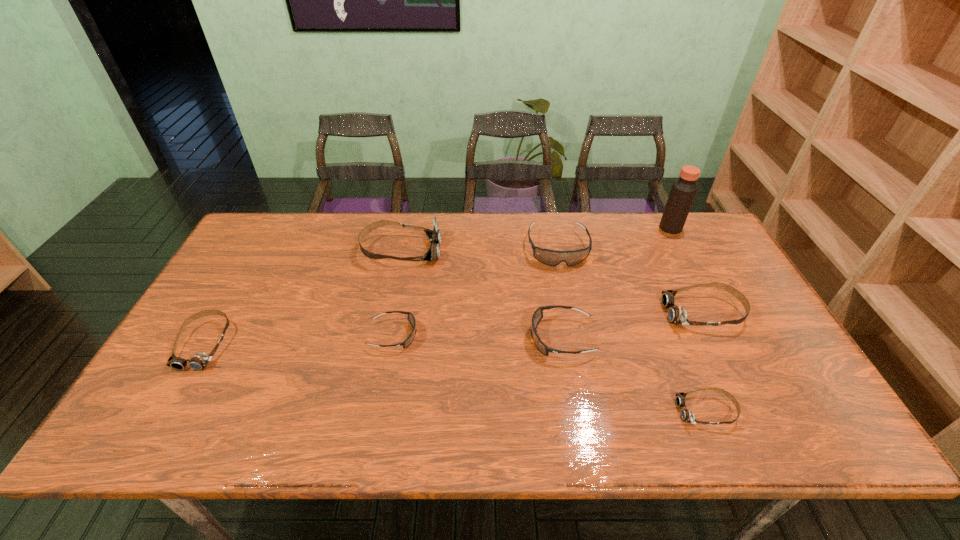
Where is `the tallest object`? the tallest object is located at coordinates (683, 191).

The image size is (960, 540). What are the coordinates of `vinegar` in the screenshot? It's located at (683, 191).

The width and height of the screenshot is (960, 540). Find the location of `the second brown goggles from left to right`. the second brown goggles from left to right is located at coordinates (434, 235).

Locate an element on the screen. The height and width of the screenshot is (540, 960). the tallest goggles is located at coordinates (434, 235).

The width and height of the screenshot is (960, 540). What are the coordinates of `the farthest black goggles` in the screenshot? It's located at (549, 257).

Where is `the third smallest brown goggles`? the third smallest brown goggles is located at coordinates (676, 315).

The width and height of the screenshot is (960, 540). I want to click on the second smallest black goggles, so click(537, 316).

I want to click on the leftmost goggles, so click(199, 361).

Find the location of a particular element. The height and width of the screenshot is (540, 960). the leftmost brown goggles is located at coordinates (199, 361).

The height and width of the screenshot is (540, 960). Identify the location of the leftmost black goggles. (411, 318).